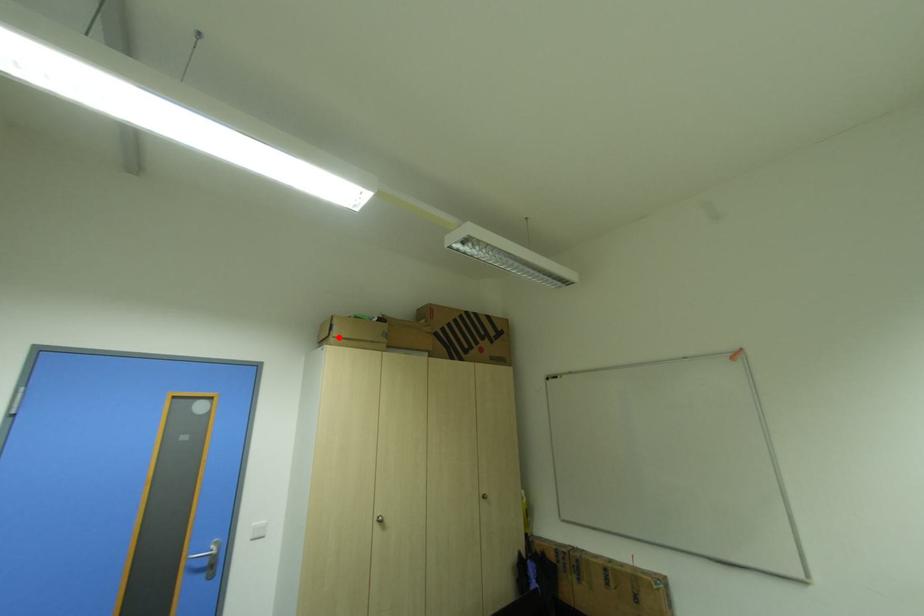
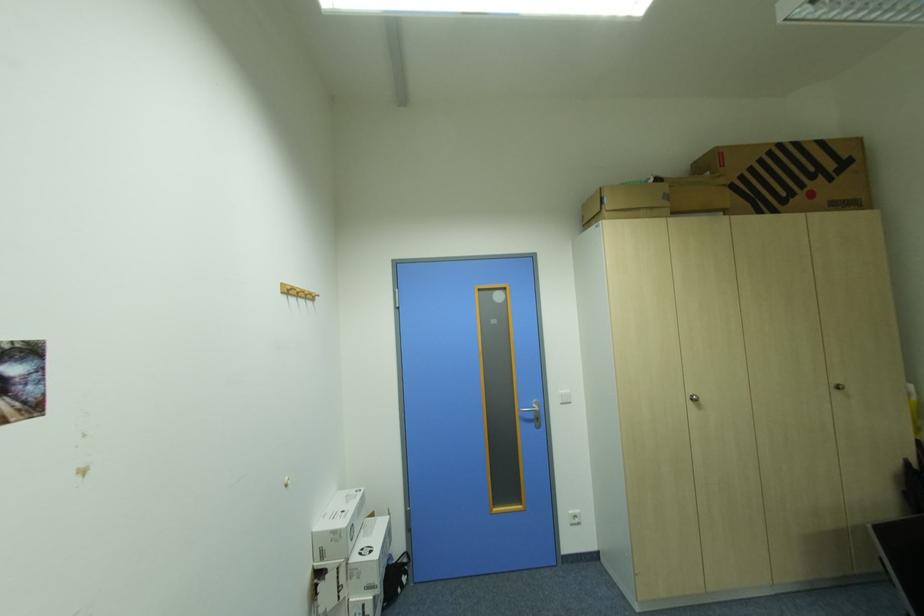
Question: I am providing you with two images of the same scene from different viewpoints. A red point is marked on the first image. Is the red point's position out of view in image 2?

Choices:
 (A) Yes
 (B) No

Answer: (B)